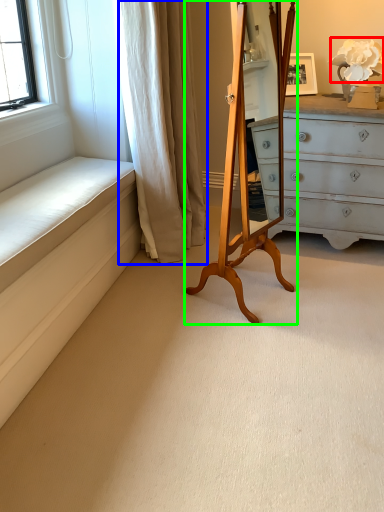
Question: Which object is the closest to the flower (highlighted by a red box)? Choose among these: curtain (highlighted by a blue box) or easel (highlighted by a green box).

Choices:
 (A) curtain
 (B) easel

Answer: (B)